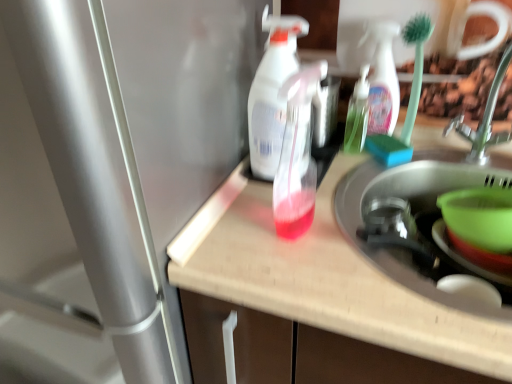
Question: Do you think green plastic bowl at sink right is within translucent plastic bottle at center, the 1th bottle viewed from the right, or outside of it?

Choices:
 (A) outside
 (B) inside

Answer: (A)

Question: Is green plastic bowl at sink right wider or thinner than translucent plastic bottle at center, the 1th bottle viewed from the right?

Choices:
 (A) wide
 (B) thin

Answer: (A)

Question: Considering the real-world distances, which object is farthest from the translucent plastic bottle at center?

Choices:
 (A) brushed metal water heater at left
 (B) translucent plastic spray bottle at center, which appears as the second bottle when viewed from the right
 (C) translucent plastic bottle at center, the 1th bottle viewed from the right
 (D) green plastic bowl at sink right
 (E) green plastic bowl at lower right

Answer: (C)

Question: Which object is positioned closest to the translucent plastic bottle at center?

Choices:
 (A) green plastic bowl at sink right
 (B) translucent plastic spray bottle at center, which appears as the second bottle when viewed from the right
 (C) translucent plastic spray bottle at center
 (D) brushed metal water heater at left
 (E) translucent plastic bottle at center, which ranks as the second bottle in left-to-right order

Answer: (B)